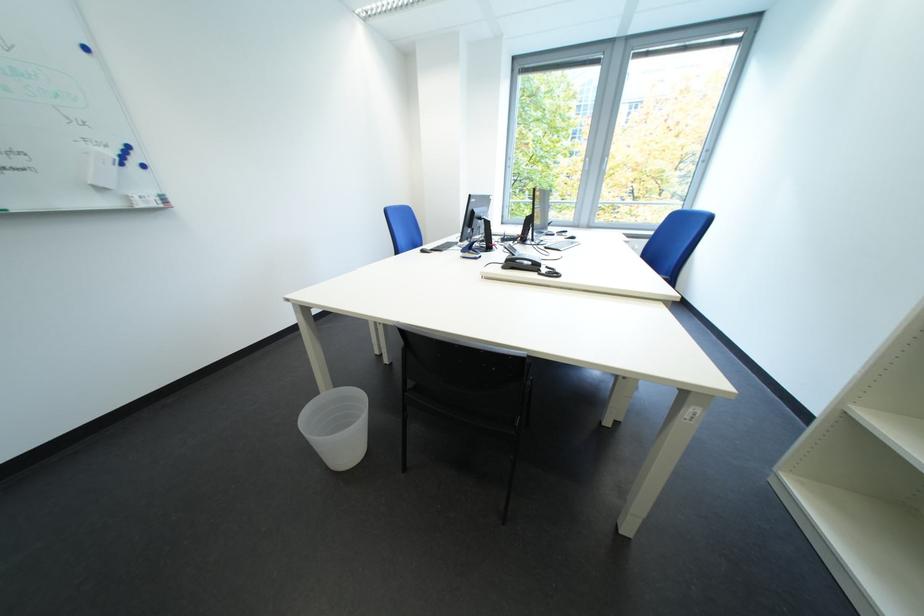
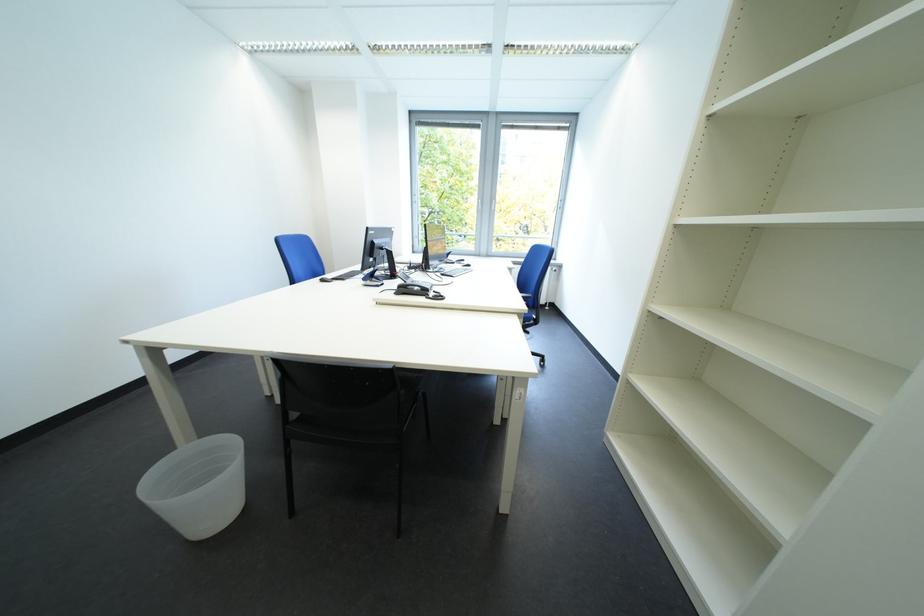
The images are taken continuously from a first-person perspective. In which direction are you moving?

The cameraman moved toward right, backward.